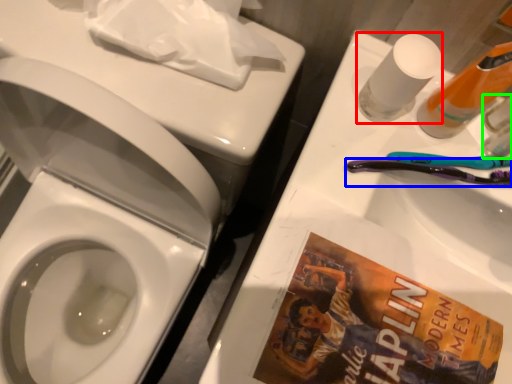
Question: Based on their relative distances, which object is nearer to mouthwash (highlighted by a red box)? Choose from toothbrush (highlighted by a blue box) and mouthwash (highlighted by a green box).

Choices:
 (A) toothbrush
 (B) mouthwash

Answer: (A)